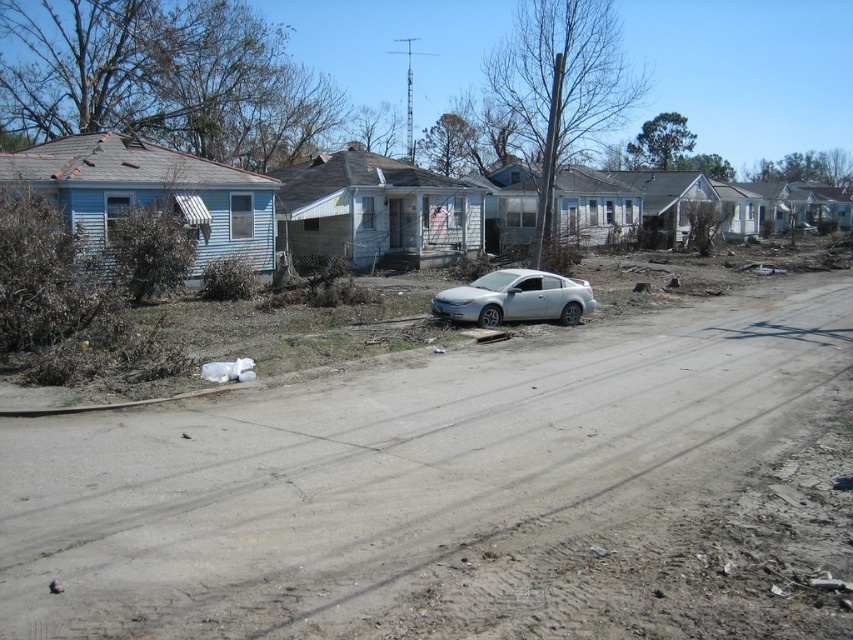
Question: Which object is closer to the camera taking this photo?

Choices:
 (A) silver metallic car at center
 (B) gray dirt track at center

Answer: (B)

Question: Does gray dirt track at center have a greater width compared to silver metallic car at center?

Choices:
 (A) yes
 (B) no

Answer: (A)

Question: Which point is closer to the camera taking this photo?

Choices:
 (A) (379, 486)
 (B) (498, 273)

Answer: (A)

Question: Does gray dirt track at center lie in front of silver metallic car at center?

Choices:
 (A) yes
 (B) no

Answer: (A)

Question: Which point appears farthest from the camera in this image?

Choices:
 (A) (810, 380)
 (B) (479, 305)

Answer: (B)

Question: Does gray dirt track at center appear on the right side of silver metallic car at center?

Choices:
 (A) yes
 (B) no

Answer: (B)